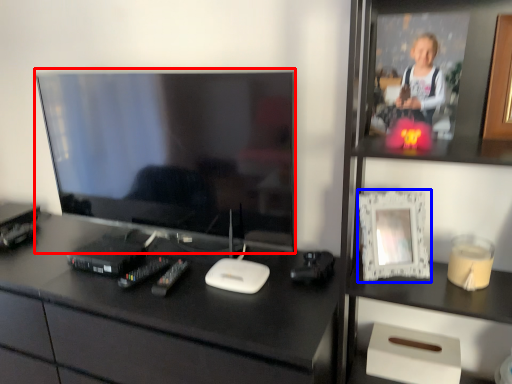
Question: Which point is further to the camera, television (highlighted by a red box) or picture frame (highlighted by a blue box)?

Choices:
 (A) television
 (B) picture frame

Answer: (A)